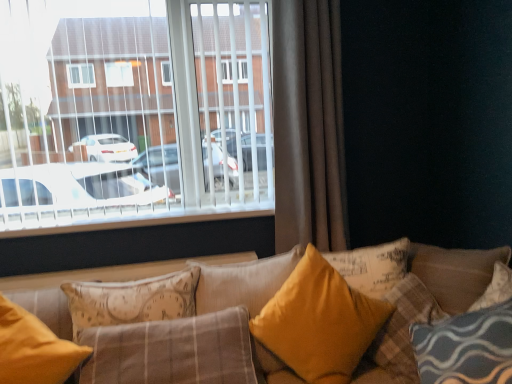
Question: Does white plastic blinds at upper left come behind matte yellow pillow at lower left, which appears as the first pillow when viewed from the left?

Choices:
 (A) no
 (B) yes

Answer: (B)

Question: Does white plastic blinds at upper left have a lesser height compared to matte yellow pillow at lower left, which appears as the first pillow when viewed from the left?

Choices:
 (A) yes
 (B) no

Answer: (B)

Question: Is white plastic blinds at upper left next to matte yellow pillow at lower left, which is counted as the 5th pillow, starting from the right?

Choices:
 (A) yes
 (B) no

Answer: (B)

Question: Is there a large distance between white plastic blinds at upper left and matte yellow pillow at lower left, which is counted as the 5th pillow, starting from the right?

Choices:
 (A) yes
 (B) no

Answer: (B)

Question: Does white plastic blinds at upper left have a lesser width compared to matte yellow pillow at lower left, which is counted as the 5th pillow, starting from the right?

Choices:
 (A) no
 (B) yes

Answer: (B)

Question: From their relative heights in the image, would you say yellow fabric pillow at center, which is the 4th pillow from right to left, is taller or shorter than velvet yellow pillow at center, the 2th pillow viewed from the right?

Choices:
 (A) short
 (B) tall

Answer: (B)

Question: Considering the positions of yellow fabric pillow at center, which is the 4th pillow from right to left, and velvet yellow pillow at center, which appears as the fourth pillow when viewed from the left, in the image, is yellow fabric pillow at center, which is the 4th pillow from right to left, wider or thinner than velvet yellow pillow at center, which appears as the fourth pillow when viewed from the left,?

Choices:
 (A) wide
 (B) thin

Answer: (B)

Question: Is point (266, 294) closer or farther from the camera than point (390, 284)?

Choices:
 (A) closer
 (B) farther

Answer: (A)

Question: Visually, is yellow fabric pillow at center, which appears as the 2th pillow when viewed from the left, positioned to the left or to the right of velvet yellow pillow at center, which appears as the fourth pillow when viewed from the left?

Choices:
 (A) left
 (B) right

Answer: (A)

Question: In terms of height, does white plastic blinds at upper left look taller or shorter compared to yellow fabric pillow at center, which is the first pillow in right-to-left order?

Choices:
 (A) short
 (B) tall

Answer: (B)

Question: From a real-world perspective, relative to yellow fabric pillow at center, which is the first pillow in right-to-left order, is white plastic blinds at upper left vertically above or below?

Choices:
 (A) above
 (B) below

Answer: (A)

Question: Do you think white plastic blinds at upper left is within yellow fabric pillow at center, which is the first pillow in right-to-left order, or outside of it?

Choices:
 (A) inside
 (B) outside

Answer: (B)

Question: From the image's perspective, is white plastic blinds at upper left above or below yellow fabric pillow at center, placed as the 5th pillow when sorted from left to right?

Choices:
 (A) below
 (B) above

Answer: (B)

Question: In terms of width, does white plastic blinds at upper left look wider or thinner when compared to velvet yellow pillow at center, which appears as the fourth pillow when viewed from the left?

Choices:
 (A) wide
 (B) thin

Answer: (B)

Question: Considering the positions of white plastic blinds at upper left and velvet yellow pillow at center, the 2th pillow viewed from the right, in the image, is white plastic blinds at upper left taller or shorter than velvet yellow pillow at center, the 2th pillow viewed from the right,?

Choices:
 (A) short
 (B) tall

Answer: (B)